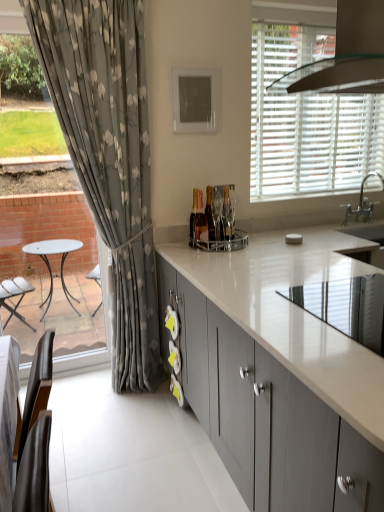
The image size is (384, 512). I want to click on free space in front of fluffy gray curtain at left, so click(117, 430).